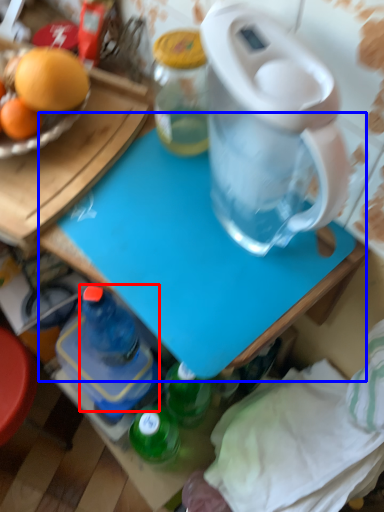
Question: Which of the following is the closest to the observer, bottle (highlighted by a red box) or table (highlighted by a blue box)?

Choices:
 (A) bottle
 (B) table

Answer: (B)